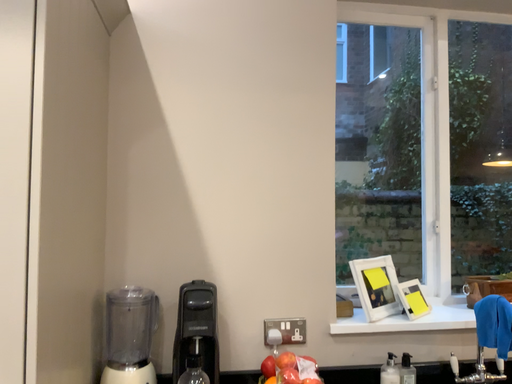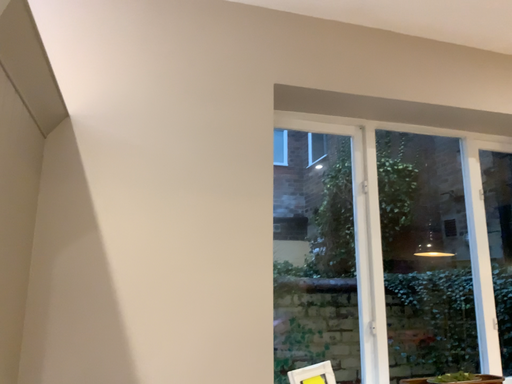
Question: Which way did the camera rotate in the video?

Choices:
 (A) rotated upward
 (B) rotated downward

Answer: (A)